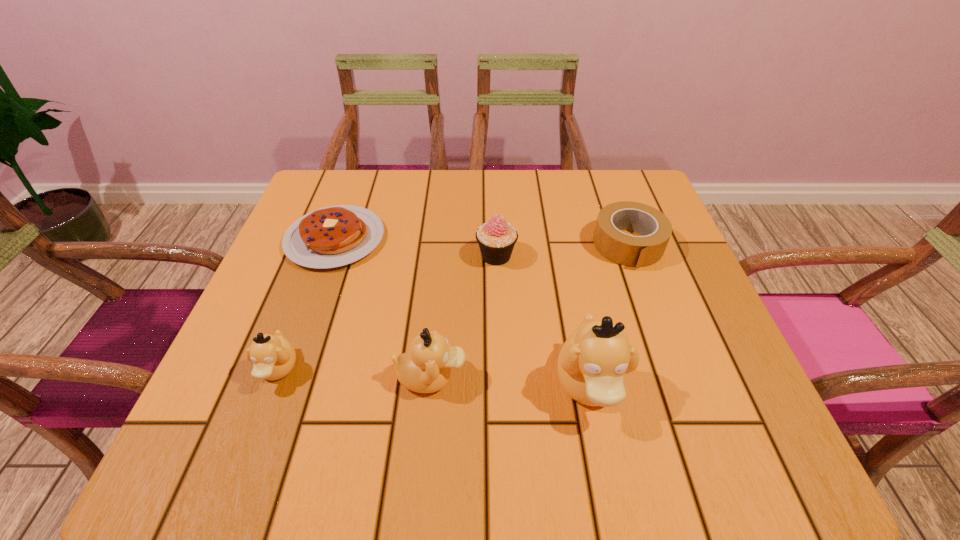
In order to click on free point located 0.280m on the face of the fourth object from right to left in this screenshot , I will do `click(625, 377)`.

Where is `blank area located 0.220m on the front of the pancake`? The height and width of the screenshot is (540, 960). blank area located 0.220m on the front of the pancake is located at coordinates (293, 357).

Find the location of a particular element. This screenshot has width=960, height=540. free space located 0.260m at the edge of the rightmost object is located at coordinates (x=675, y=373).

This screenshot has width=960, height=540. In order to click on vacant area located on the right of the cupcake in this screenshot , I will do `click(552, 256)`.

The image size is (960, 540). Identify the location of pancake located in the far edge section of the desktop. (333, 236).

Image resolution: width=960 pixels, height=540 pixels. Identify the location of duct tape at the far edge. (634, 251).

Find the location of `duckling that is at the left edge`. duckling that is at the left edge is located at coordinates (273, 356).

Identify the location of pancake present at the left edge. (333, 236).

Where is `object situated at the right edge`? object situated at the right edge is located at coordinates (634, 251).

The width and height of the screenshot is (960, 540). In order to click on object that is at the far left corner in this screenshot , I will do `click(333, 236)`.